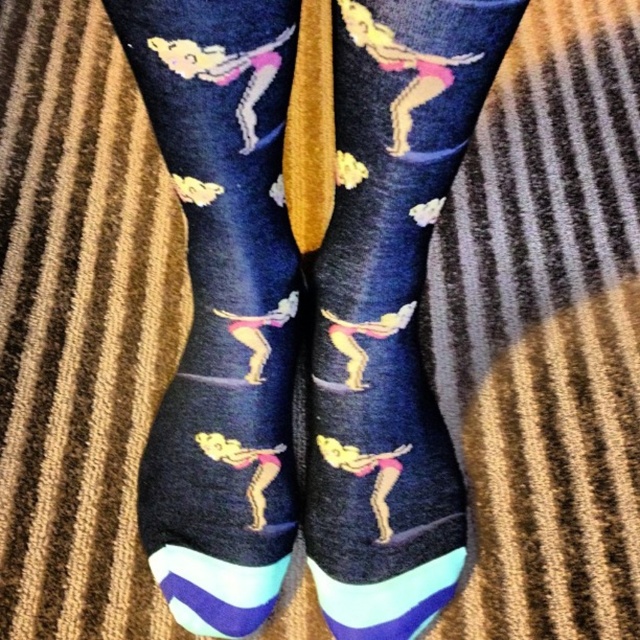
Question: Can you confirm if matte dark blue socks with colorful gymnast design at center is smaller than navy blue cotton socks at center?

Choices:
 (A) yes
 (B) no

Answer: (B)

Question: Among these points, which one is farthest from the camera?

Choices:
 (A) (202, 80)
 (B) (362, 634)

Answer: (B)

Question: Is matte dark blue socks with colorful gymnast design at center above navy blue cotton socks at center?

Choices:
 (A) yes
 (B) no

Answer: (A)

Question: Is matte dark blue socks with colorful gymnast design at center to the left of navy blue cotton socks at center from the viewer's perspective?

Choices:
 (A) no
 (B) yes

Answer: (A)